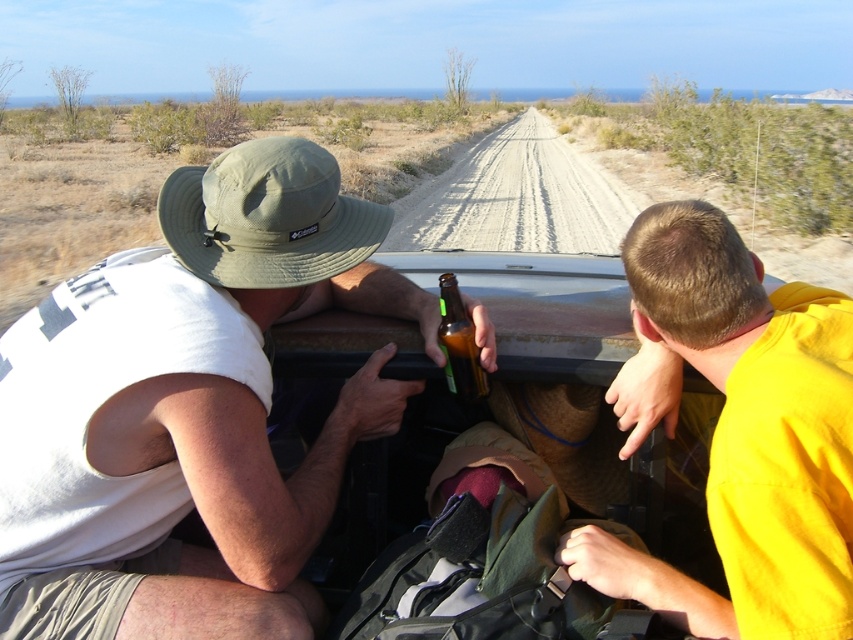
Does matte green hat at upper left appear over brown glass bottle at center?

No, matte green hat at upper left is not above brown glass bottle at center.

Who is more forward, (480, 362) or (480, 372)?

Point (480, 362) is in front.

Does point (238, 355) come closer to viewer compared to point (457, 387)?

Yes, it is in front of point (457, 387).

In order to click on matte green hat at upper left in this screenshot , I will do `click(189, 410)`.

Can you confirm if matte green hat at upper left is wider than yellow matte truck at right?

Yes, matte green hat at upper left is wider than yellow matte truck at right.

Is matte green hat at upper left above yellow matte truck at right?

Incorrect, matte green hat at upper left is not positioned above yellow matte truck at right.

You are a GUI agent. You are given a task and a screenshot of the screen. Output one action in this format:
    pyautogui.click(x=<x>, y=<y>)
    Task: Click on the matte green hat at upper left
    
    Given the screenshot: What is the action you would take?
    pyautogui.click(x=189, y=410)

Can you confirm if yellow matte truck at right is smaller than brown glass bottle at center?

Incorrect, yellow matte truck at right is not smaller in size than brown glass bottle at center.

In the scene shown: Which of these two, yellow matte truck at right or brown glass bottle at center, stands taller?

yellow matte truck at right is taller.

Which is behind, point (769, 632) or point (447, 304)?

Positioned behind is point (447, 304).

You are a GUI agent. You are given a task and a screenshot of the screen. Output one action in this format:
    pyautogui.click(x=<x>, y=<y>)
    Task: Click on the yellow matte truck at right
    
    Given the screenshot: What is the action you would take?
    pyautogui.click(x=746, y=433)